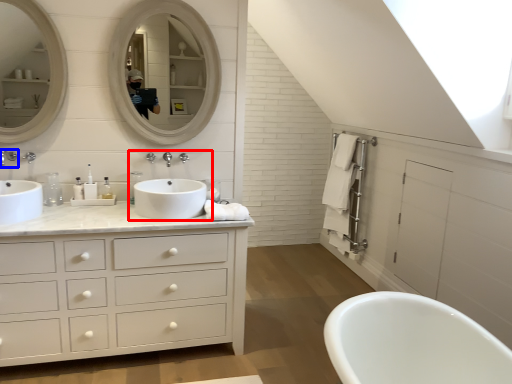
Question: Which object is closer to the camera taking this photo, sink (highlighted by a red box) or tap (highlighted by a blue box)?

Choices:
 (A) sink
 (B) tap

Answer: (A)